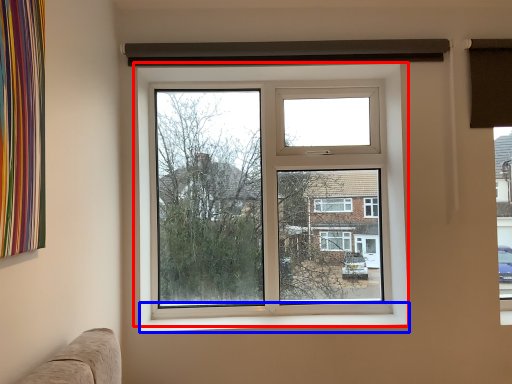
Question: Which point is further to the camera, window (highlighted by a red box) or window sill (highlighted by a blue box)?

Choices:
 (A) window
 (B) window sill

Answer: (A)